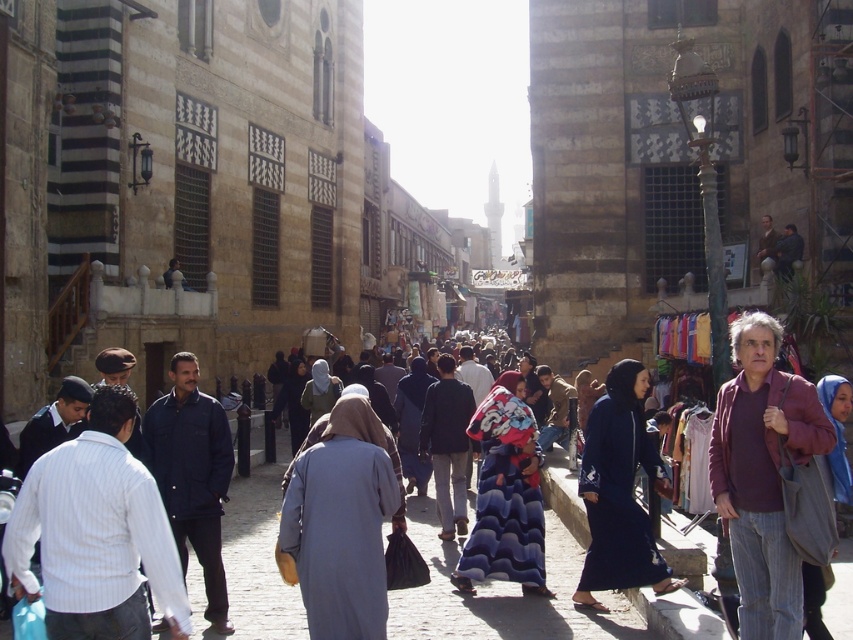
Question: Which point appears farthest from the camera in this image?

Choices:
 (A) (523, 380)
 (B) (804, 577)
 (C) (592, 529)
 (D) (347, 502)

Answer: (A)

Question: Among these objects, which one is nearest to the camera?

Choices:
 (A) blue fabric hijab at center
 (B) light gray fabric dress at center

Answer: (A)

Question: Among these objects, which one is farthest from the camera?

Choices:
 (A) dark blue fabric abaya at center
 (B) light gray fabric dress at center
 (C) blue textured dress at center

Answer: (C)

Question: Does blue textured dress at center have a greater width compared to blue fabric hijab at center?

Choices:
 (A) no
 (B) yes

Answer: (A)

Question: Can you confirm if light gray fabric dress at center is positioned below blue textured dress at center?

Choices:
 (A) yes
 (B) no

Answer: (A)

Question: Can you confirm if light gray fabric dress at center is positioned to the left of dark blue fabric abaya at center?

Choices:
 (A) no
 (B) yes

Answer: (B)